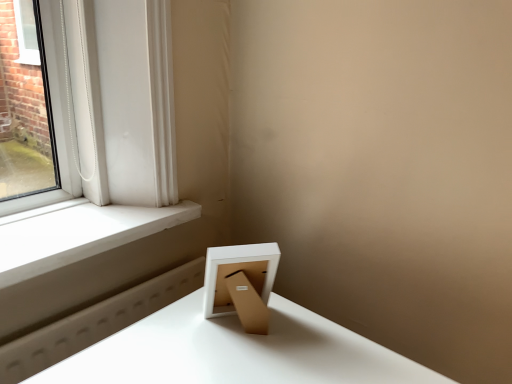
Question: From the image's perspective, is white matte picture frame at lower right positioned above or below white smooth window sill at left?

Choices:
 (A) above
 (B) below

Answer: (B)

Question: Considering the positions of point (268, 254) and point (184, 208), is point (268, 254) closer or farther from the camera than point (184, 208)?

Choices:
 (A) closer
 (B) farther

Answer: (A)

Question: In terms of height, does white matte picture frame at lower right look taller or shorter compared to white smooth window sill at left?

Choices:
 (A) short
 (B) tall

Answer: (B)

Question: Considering the positions of white smooth window sill at left and white matte picture frame at lower right in the image, is white smooth window sill at left taller or shorter than white matte picture frame at lower right?

Choices:
 (A) tall
 (B) short

Answer: (B)

Question: In the image, is white smooth window sill at left positioned in front of or behind white matte picture frame at lower right?

Choices:
 (A) front
 (B) behind

Answer: (B)

Question: From a real-world perspective, is white smooth window sill at left physically located above or below white matte picture frame at lower right?

Choices:
 (A) below
 (B) above

Answer: (A)

Question: Choose the correct answer: Is white smooth window sill at left inside white matte picture frame at lower right or outside it?

Choices:
 (A) inside
 (B) outside

Answer: (B)